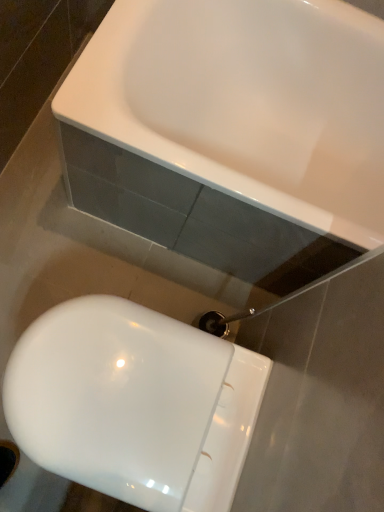
Question: From a real-world perspective, is white glossy bathtub at upper center beneath white glossy toilet at lower left?

Choices:
 (A) yes
 (B) no

Answer: (B)

Question: Is white glossy bathtub at upper center closer to the viewer compared to white glossy toilet at lower left?

Choices:
 (A) no
 (B) yes

Answer: (A)

Question: Is white glossy bathtub at upper center facing away from white glossy toilet at lower left?

Choices:
 (A) no
 (B) yes

Answer: (A)

Question: From the image's perspective, does white glossy bathtub at upper center appear higher than white glossy toilet at lower left?

Choices:
 (A) no
 (B) yes

Answer: (B)

Question: Considering the relative sizes of white glossy bathtub at upper center and white glossy toilet at lower left in the image provided, is white glossy bathtub at upper center shorter than white glossy toilet at lower left?

Choices:
 (A) yes
 (B) no

Answer: (B)

Question: Is white glossy bathtub at upper center taller than white glossy toilet at lower left?

Choices:
 (A) no
 (B) yes

Answer: (B)

Question: From the image's perspective, is white glossy toilet at lower left above white glossy bathtub at upper center?

Choices:
 (A) yes
 (B) no

Answer: (B)

Question: Is white glossy toilet at lower left taller than white glossy bathtub at upper center?

Choices:
 (A) no
 (B) yes

Answer: (A)

Question: Can you confirm if white glossy toilet at lower left is shorter than white glossy bathtub at upper center?

Choices:
 (A) no
 (B) yes

Answer: (B)

Question: Considering the relative positions of white glossy toilet at lower left and white glossy bathtub at upper center in the image provided, is white glossy toilet at lower left to the right of white glossy bathtub at upper center from the viewer's perspective?

Choices:
 (A) no
 (B) yes

Answer: (A)

Question: Would you say white glossy toilet at lower left contains white glossy bathtub at upper center?

Choices:
 (A) yes
 (B) no

Answer: (B)

Question: Is the surface of white glossy toilet at lower left in direct contact with white glossy bathtub at upper center?

Choices:
 (A) no
 (B) yes

Answer: (A)

Question: Would you say white glossy bathtub at upper center is to the left or to the right of white glossy toilet at lower left in the picture?

Choices:
 (A) right
 (B) left

Answer: (A)